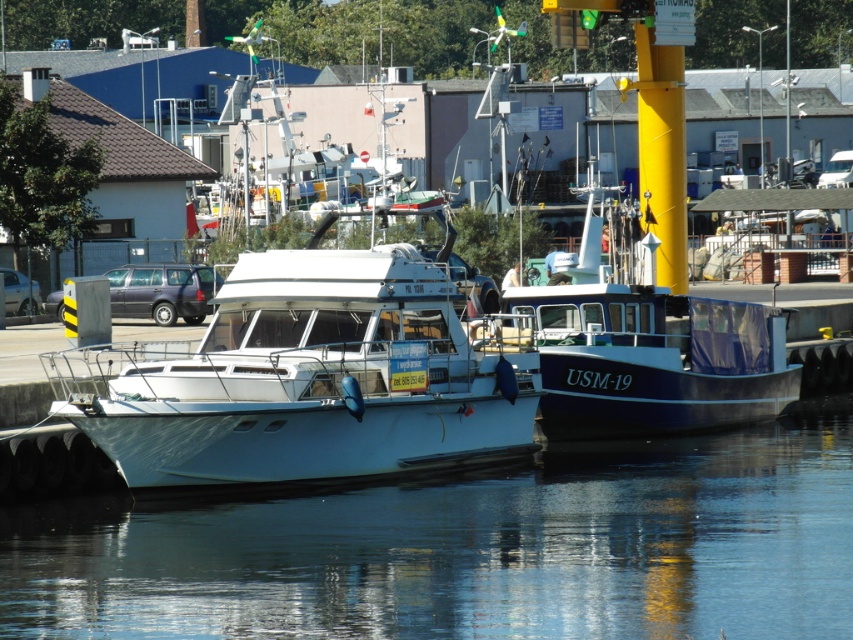
You are a photographer standing on the dock and want to capture both the transparent water at lower center and the white glossy boat at center in a single shot. Based on their heights, which object will appear larger in the photo?

The transparent water at lower center is taller than the white glossy boat at center, so it will appear larger in the photo.

You are a photographer planning to take a wide shot of the marina. You want to ensure that both the transparent water at lower center and the white glossy boat at center are fully visible in the frame. Based on their widths, which object should you position closer to the edge of the frame to accommodate their sizes?

The transparent water at lower center is wider than the white glossy boat at center. To accommodate their sizes, position the white glossy boat at center closer to the edge of the frame so that the wider transparent water at lower center can be fully captured without cropping.

You are standing on the pier and want to take a photo of the white glossy boat at center and the transparent water at lower center. Which object is positioned lower in the frame?

The transparent water at lower center is located below the white glossy boat at center, so it is positioned lower in the frame.